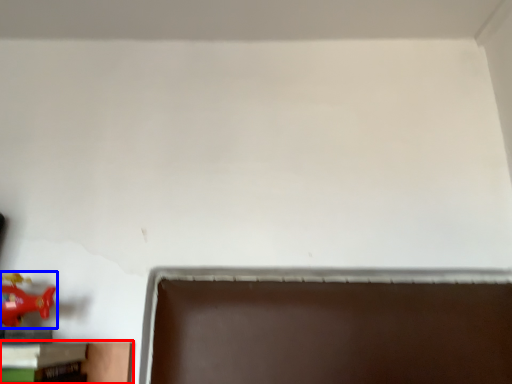
Question: Which object is closer to the camera taking this photo, furniture (highlighted by a red box) or toy (highlighted by a blue box)?

Choices:
 (A) furniture
 (B) toy

Answer: (A)